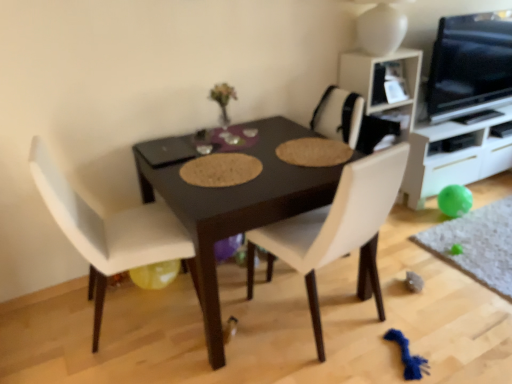
Question: From a real-world perspective, is white leather chair at left, acting as the 2th chair starting from the right, on top of green rubber ball at lower right?

Choices:
 (A) no
 (B) yes

Answer: (B)

Question: From the image's perspective, is white leather chair at left, acting as the 2th chair starting from the right, above green rubber ball at lower right?

Choices:
 (A) yes
 (B) no

Answer: (A)

Question: Is white leather chair at left, acting as the 2th chair starting from the right, far away from green rubber ball at lower right?

Choices:
 (A) no
 (B) yes

Answer: (B)

Question: Is white leather chair at left, the 1th chair in the left-to-right sequence, turned away from green rubber ball at lower right?

Choices:
 (A) yes
 (B) no

Answer: (B)

Question: Does white leather chair at left, acting as the 2th chair starting from the right, touch green rubber ball at lower right?

Choices:
 (A) yes
 (B) no

Answer: (B)

Question: Considering the relative positions of white leather chair at left, the 1th chair in the left-to-right sequence, and green rubber ball at lower right in the image provided, is white leather chair at left, the 1th chair in the left-to-right sequence, behind green rubber ball at lower right?

Choices:
 (A) no
 (B) yes

Answer: (A)

Question: Is white glossy cabinet at right directly adjacent to white leather chair at left, the 1th chair in the left-to-right sequence?

Choices:
 (A) yes
 (B) no

Answer: (B)

Question: From a real-world perspective, is white glossy cabinet at right on white leather chair at left, acting as the 2th chair starting from the right?

Choices:
 (A) yes
 (B) no

Answer: (B)

Question: From the image's perspective, is white glossy cabinet at right beneath white leather chair at left, the 1th chair in the left-to-right sequence?

Choices:
 (A) yes
 (B) no

Answer: (B)

Question: Considering the relative sizes of white glossy cabinet at right and white leather chair at left, acting as the 2th chair starting from the right, in the image provided, is white glossy cabinet at right shorter than white leather chair at left, acting as the 2th chair starting from the right,?

Choices:
 (A) yes
 (B) no

Answer: (A)

Question: From a real-world perspective, is white glossy cabinet at right physically below white leather chair at left, the 1th chair in the left-to-right sequence?

Choices:
 (A) no
 (B) yes

Answer: (B)

Question: Considering the relative sizes of white glossy cabinet at right and white leather chair at left, acting as the 2th chair starting from the right, in the image provided, is white glossy cabinet at right taller than white leather chair at left, acting as the 2th chair starting from the right,?

Choices:
 (A) yes
 (B) no

Answer: (B)

Question: Does white glossy cabinet at right appear on the left side of yellow rubber balloon at lower left?

Choices:
 (A) no
 (B) yes

Answer: (A)